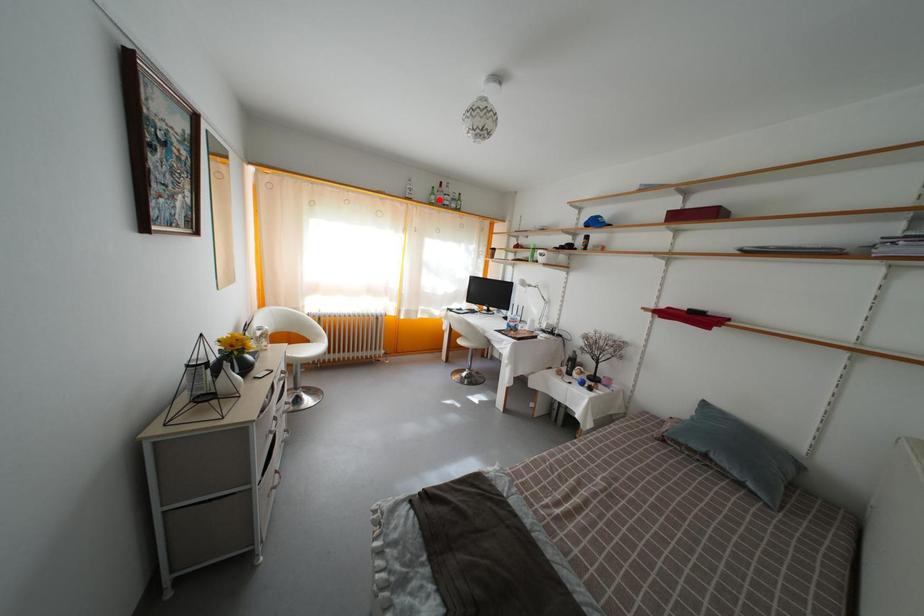
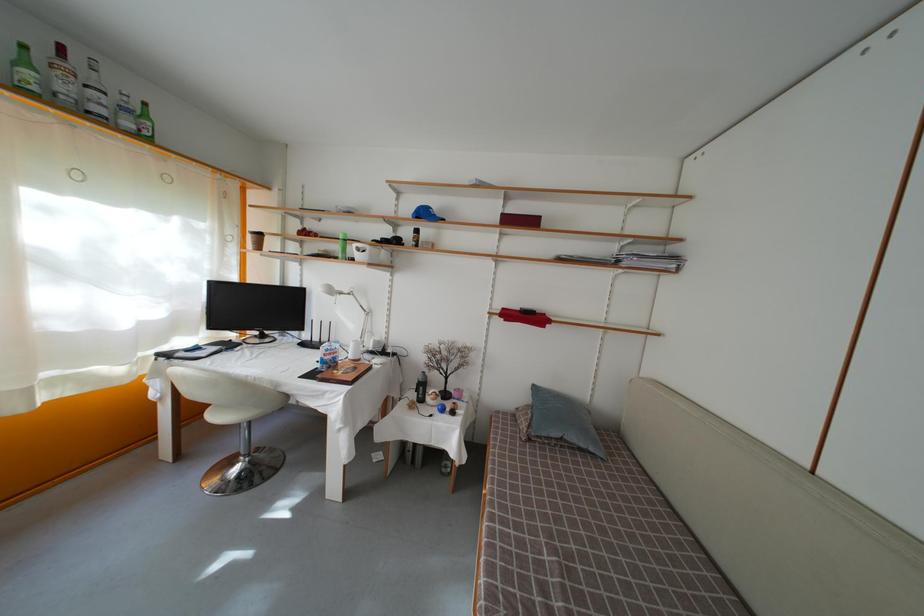
Question: I am providing you with two images of the same scene from different viewpoints. A red point is shown in image1. For the corresponding object point in image2, is it positioned nearer or farther from the camera?

Choices:
 (A) Nearer
 (B) Farther

Answer: (B)